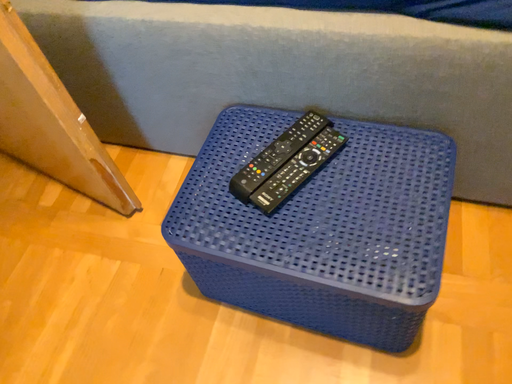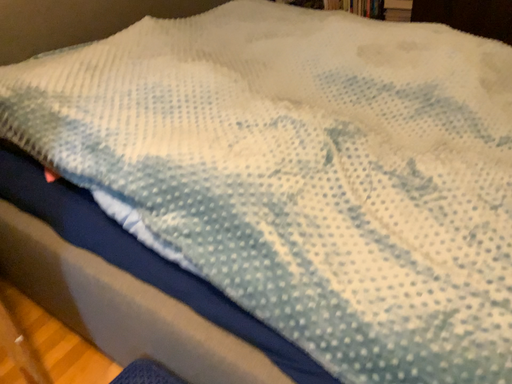
Question: Which way did the camera rotate in the video?

Choices:
 (A) rotated upward
 (B) rotated downward

Answer: (A)